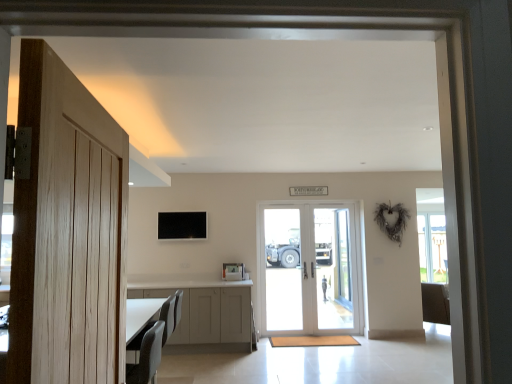
Question: Are white glossy door at center, acting as the first door starting from the right, and light wood door at left, which is the first door from left to right, far apart?

Choices:
 (A) no
 (B) yes

Answer: (B)

Question: Is light wood door at left, which is the 1th door in front-to-back order, surrounded by white glossy door at center, the first door from the back?

Choices:
 (A) yes
 (B) no

Answer: (B)

Question: Is white glossy door at center, the first door from the back, not inside light wood door at left, which is the 1th door in front-to-back order?

Choices:
 (A) yes
 (B) no

Answer: (A)

Question: Considering the relative sizes of white glossy door at center, which is the 2th door from left to right, and light wood door at left, which is counted as the 2th door, starting from the back, in the image provided, is white glossy door at center, which is the 2th door from left to right, smaller than light wood door at left, which is counted as the 2th door, starting from the back,?

Choices:
 (A) yes
 (B) no

Answer: (B)

Question: Could you tell me if white glossy door at center, the first door from the back, is turned towards light wood door at left, which is the first door from left to right?

Choices:
 (A) no
 (B) yes

Answer: (B)

Question: Considering the relative positions of white glossy door at center, positioned as the 2th door in front-to-back order, and light wood door at left, which is counted as the 2th door, starting from the back, in the image provided, is white glossy door at center, positioned as the 2th door in front-to-back order, in front of light wood door at left, which is counted as the 2th door, starting from the back,?

Choices:
 (A) no
 (B) yes

Answer: (A)

Question: Is white glass screen door at center, which ranks as the 2th screen door in right-to-left order, next to clear glass door at center, which ranks as the 1th screen door in right-to-left order, and touching it?

Choices:
 (A) no
 (B) yes

Answer: (A)

Question: Can you confirm if white glass screen door at center, which ranks as the 2th screen door in right-to-left order, is positioned to the left of clear glass door at center, the 2th screen door viewed from the left?

Choices:
 (A) no
 (B) yes

Answer: (B)

Question: Can you confirm if white glass screen door at center, which ranks as the 2th screen door in right-to-left order, is wider than clear glass door at center, which ranks as the 1th screen door in right-to-left order?

Choices:
 (A) yes
 (B) no

Answer: (B)

Question: Considering the relative sizes of white glass screen door at center, the 1th screen door viewed from the left, and clear glass door at center, the 2th screen door viewed from the left, in the image provided, is white glass screen door at center, the 1th screen door viewed from the left, taller than clear glass door at center, the 2th screen door viewed from the left,?

Choices:
 (A) yes
 (B) no

Answer: (B)

Question: Would you say white glass screen door at center, the 1th screen door viewed from the left, is outside clear glass door at center, the 2th screen door viewed from the left?

Choices:
 (A) yes
 (B) no

Answer: (A)

Question: Is white glass screen door at center, which ranks as the 2th screen door in right-to-left order, at the right side of clear glass door at center, the 2th screen door viewed from the left?

Choices:
 (A) no
 (B) yes

Answer: (A)

Question: Does clear glass door at center, which ranks as the 1th screen door in right-to-left order, appear on the left side of white glossy door at center, the first door from the back?

Choices:
 (A) yes
 (B) no

Answer: (B)